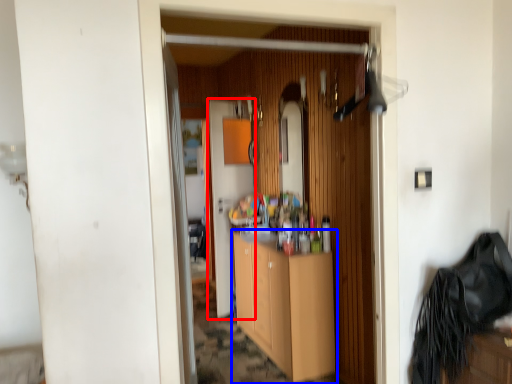
Question: Which object is further to the camera taking this photo, door (highlighted by a red box) or cabinetry (highlighted by a blue box)?

Choices:
 (A) door
 (B) cabinetry

Answer: (A)